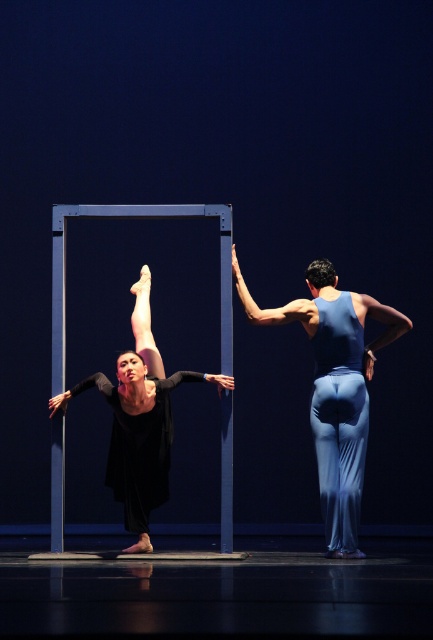
Is point (365, 417) positioned before point (96, 381)?

Yes, it is in front of point (96, 381).

Between blue fabric pants at center and black matte dress at center, which one appears on the left side from the viewer's perspective?

black matte dress at center

Image resolution: width=433 pixels, height=640 pixels. Identify the location of blue fabric pants at center. (335, 392).

Find the location of `blue fabric pants at center`. blue fabric pants at center is located at coordinates (335, 392).